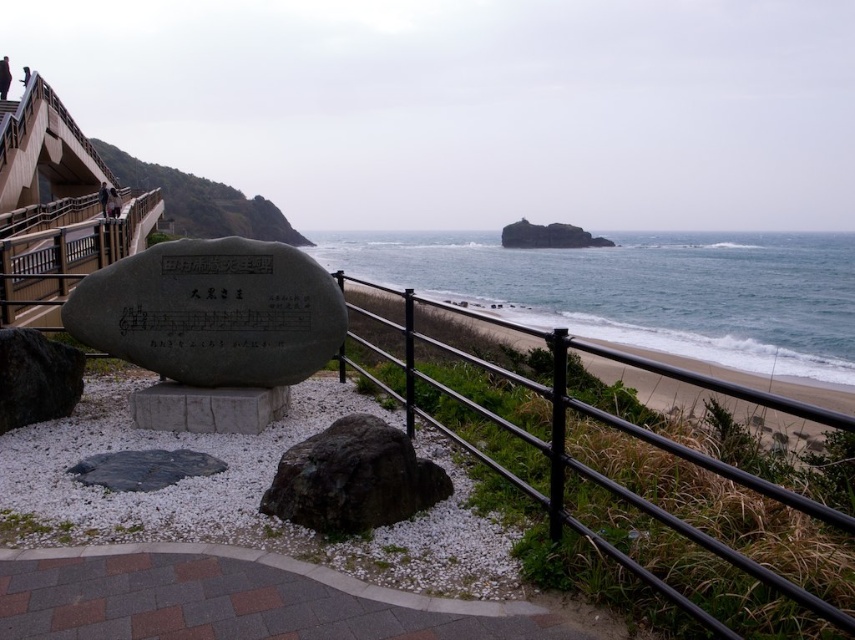
Question: Does dark brown rock at center have a smaller size compared to dark gray rock at lower left?

Choices:
 (A) no
 (B) yes

Answer: (A)

Question: Which object is the closest to the dark gray rock at lower left?

Choices:
 (A) black stone at center
 (B) black metal fence at center
 (C) dark brown rock at center

Answer: (A)

Question: Which point is closer to the camera?

Choices:
 (A) (558, 388)
 (B) (171, 401)

Answer: (A)

Question: Is black stone at center positioned before dark gray rock at lower left?

Choices:
 (A) yes
 (B) no

Answer: (B)

Question: Does dark brown rock at center appear on the right side of dark gray rock at lower left?

Choices:
 (A) no
 (B) yes

Answer: (B)

Question: Which point appears farthest from the camera in this image?

Choices:
 (A) (4, 380)
 (B) (304, 468)
 (C) (333, 323)

Answer: (C)